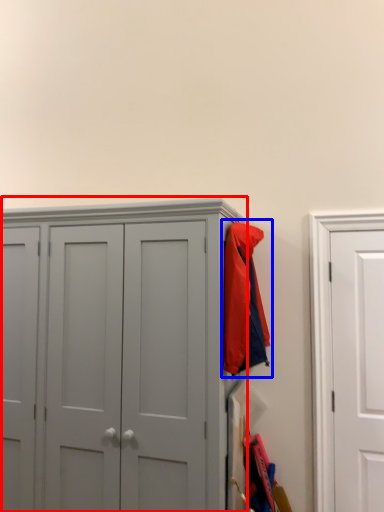
Question: Which point is further to the camera, cupboard (highlighted by a red box) or jacket (highlighted by a blue box)?

Choices:
 (A) cupboard
 (B) jacket

Answer: (B)